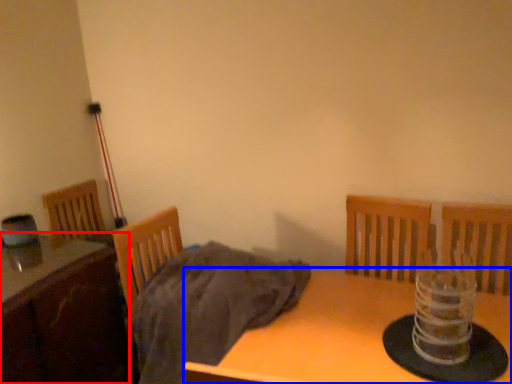
Question: Which object appears closest to the camera in this image, table (highlighted by a red box) or table (highlighted by a blue box)?

Choices:
 (A) table
 (B) table

Answer: (B)